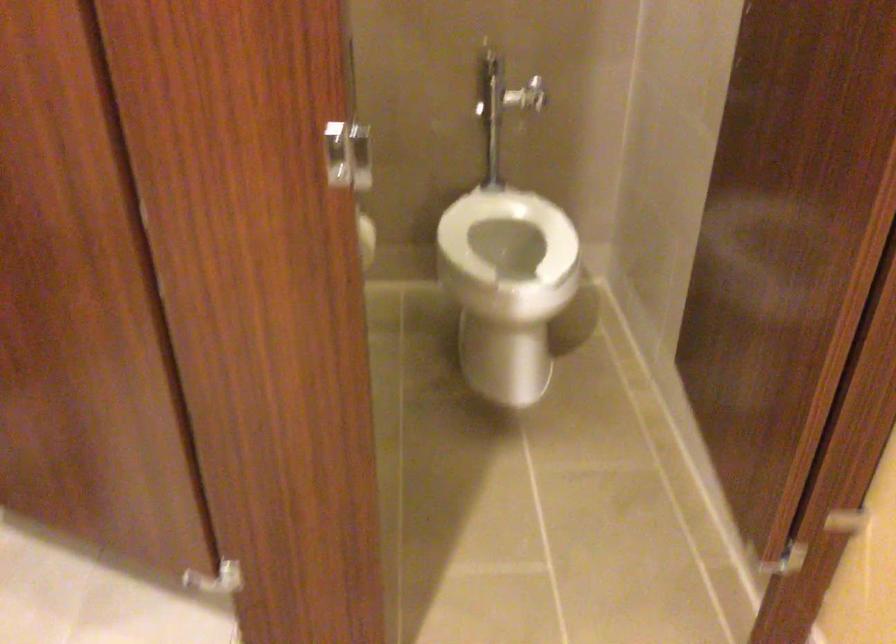
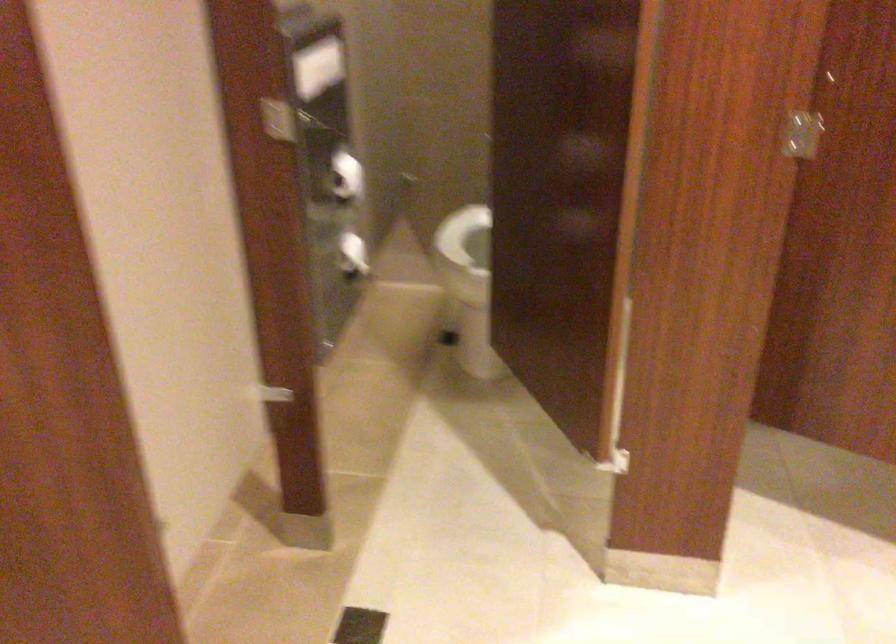
In a continuous first-person perspective shot, in which direction is the camera moving?

The cameraman walked toward left, backward.